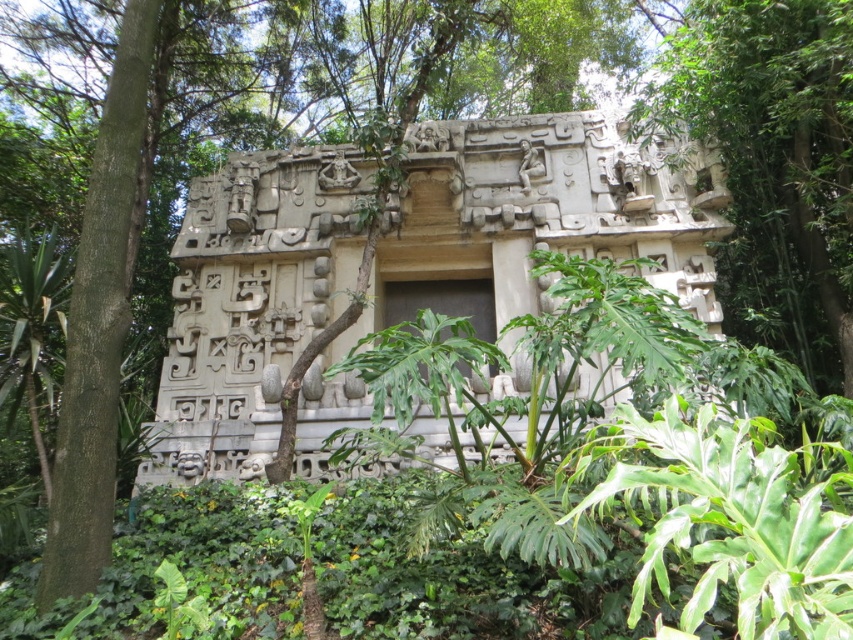
Consider the image. You are an archaeologist examining the ancient stone structure. You notice the white stone carving at center and the green leafy plant at center. Which object is closer to you from your vantage point?

The white stone carving at center is closer because the green leafy plant at center is behind it.

Looking at this image, you are an archaeologist standing in front of the ancient stone structure. You notice a white stone carving at center and a green leafy plant at center. How far apart are these two objects from each other?

The white stone carving at center and green leafy plant at center are 6.05 meters apart.